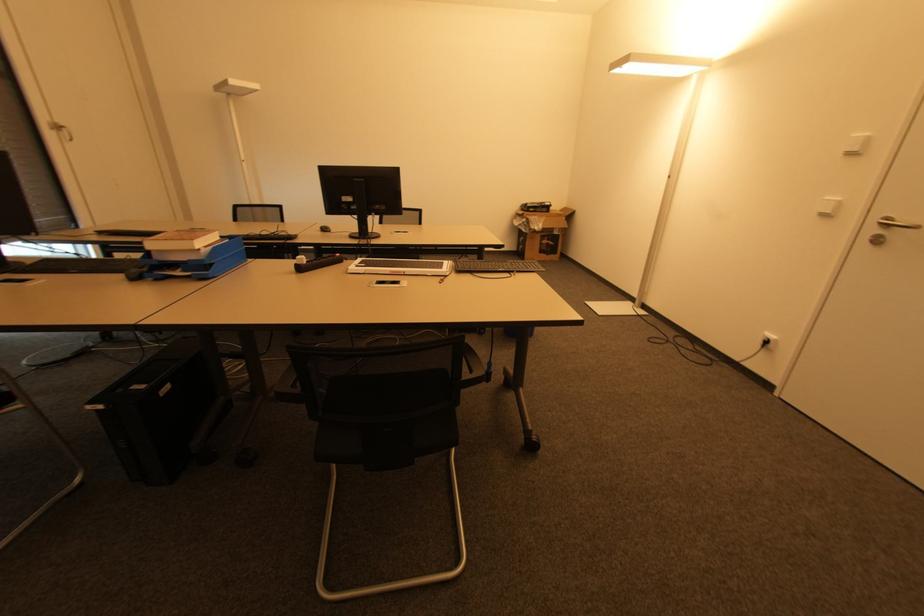
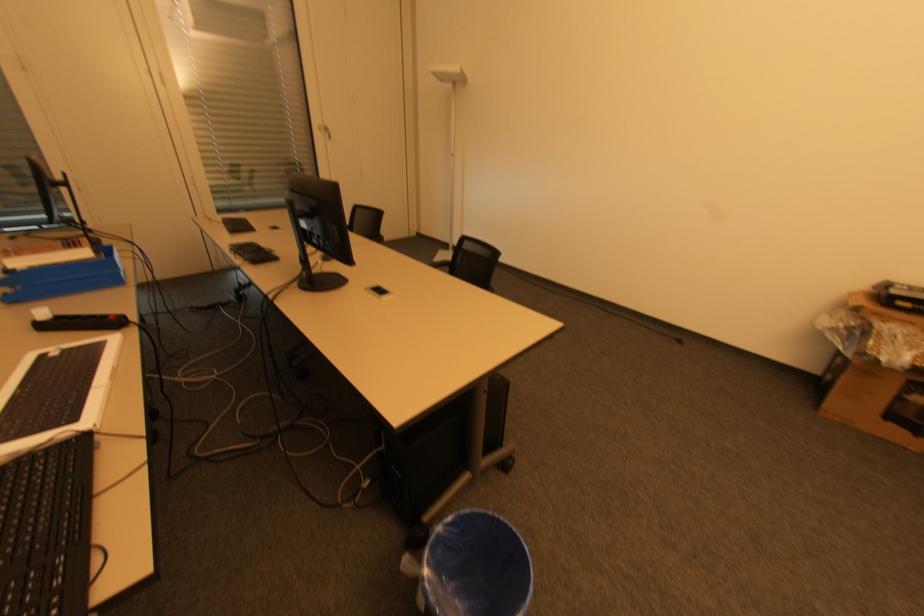
Where in the second image is the point corresponding to point (526, 223) from the first image?

(850, 328)